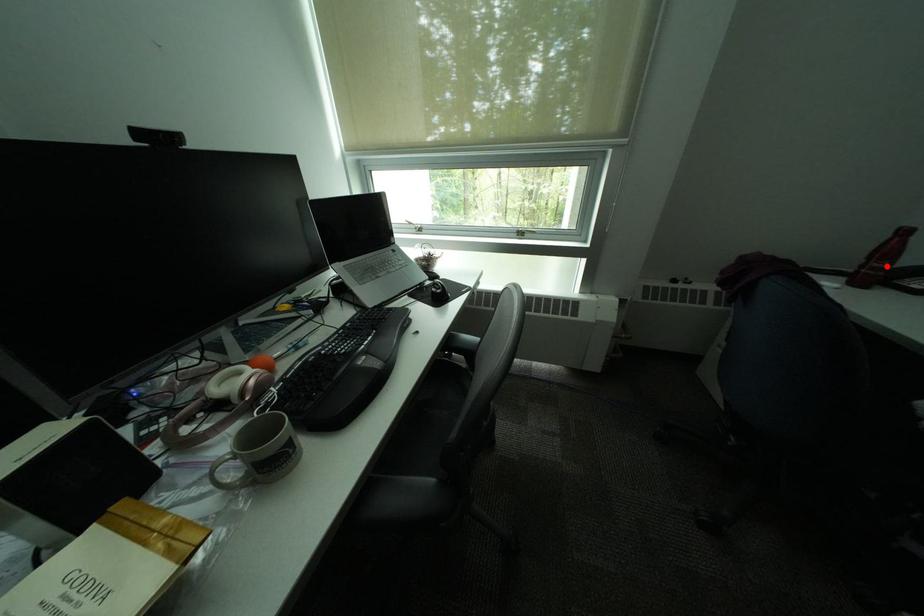
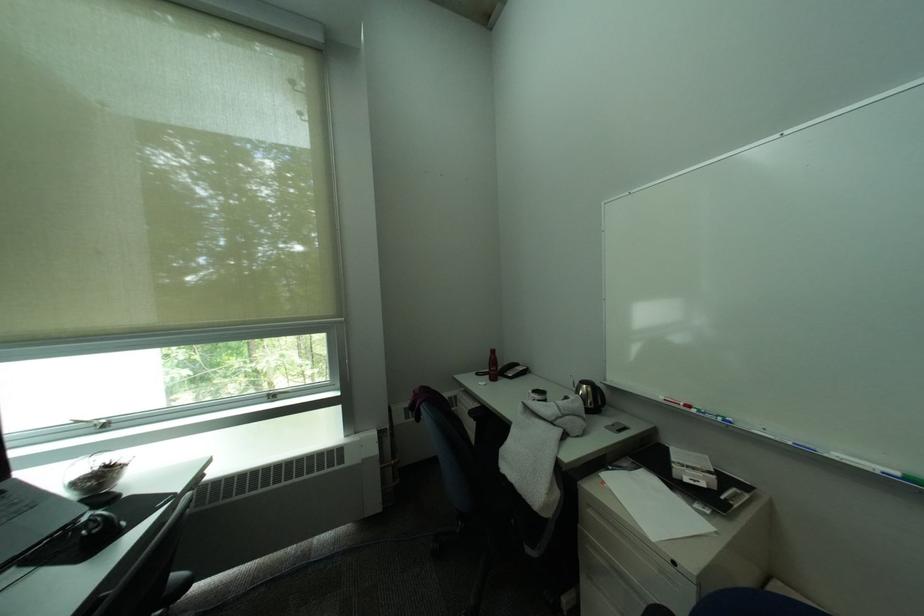
Locate, in the second image, the point that corresponds to the highlighted location in the first image.

(503, 370)